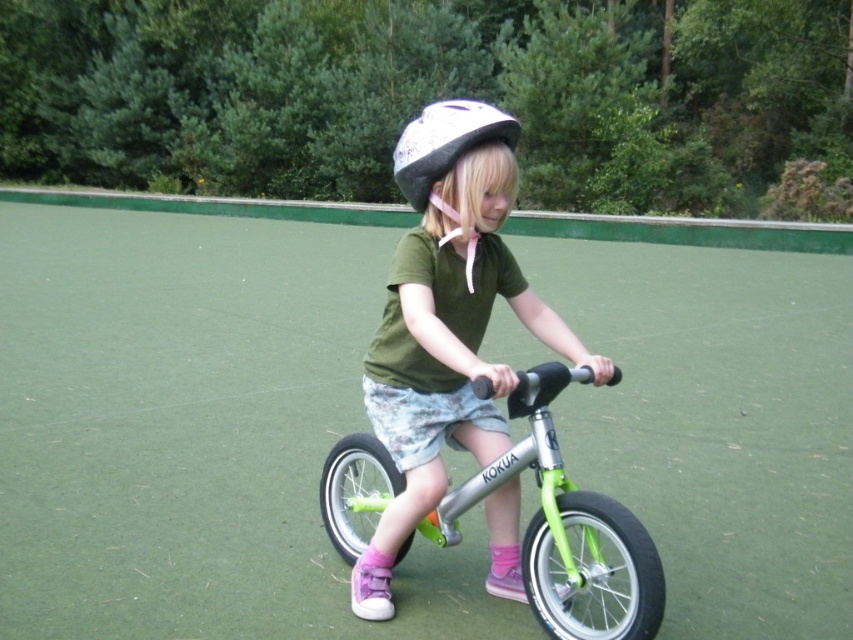
You are a parent trying to choose between the matte silver helmet at center and the white matte helmet at center for your child. Based on the scene, which helmet is shorter in height?

The matte silver helmet at center is not as tall as the white matte helmet at center, so the matte silver helmet at center is shorter in height.

Consider the image. You are standing at the point with coordinates point (x=492, y=465) and want to walk towards the point (x=425, y=148). Which direction should you go?

You should walk towards the point (x=425, y=148) because it is closer to you than point (x=492, y=465).

You are a parent watching your child play in the park. You notice the matte silver helmet at center and the green metallic bicycle at center. Which object takes up less space in the image?

The matte silver helmet at center has a smaller size compared to the green metallic bicycle at center, so it takes up less space in the image.